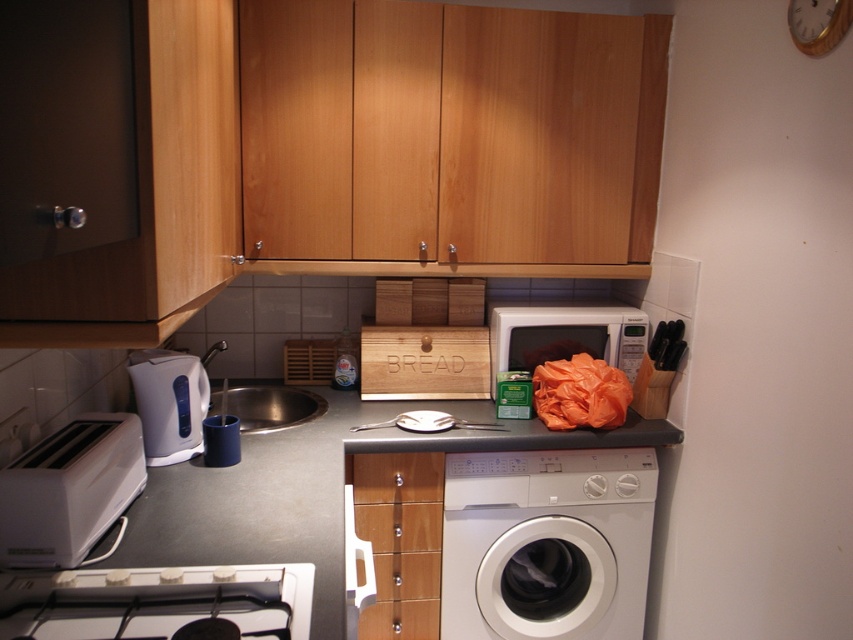
You are standing in the kitchen and want to place a recipe book on the counter near the white glossy stove at lower left so it can be seen from the wooden clock at upper right. Is the stove positioned in a way that the clock can see the book?

The white glossy stove at lower left is below the wooden clock at upper right, so the clock can see the book placed near the stove because it is positioned lower and directly under the clock.

You are standing in the kitchen and want to see the wooden clock at upper right. However, the white glossy stove at lower left is blocking your view. Can you move around the stove to get a clear view of the clock?

The white glossy stove at lower left is in front of the wooden clock at upper right, so moving around the stove would allow you to see the clock clearly.

You are moving a 70 cm wide box from the kitchen to the laundry room. You need to pass between the white glossy washing machine at lower right and the stainless steel sink at center. Can the box fit through the space between them?

The white glossy washing machine at lower right and the stainless steel sink at center are 73.46 centimeters apart from each other. Since the box is 70 centimeters wide, it can fit through the space between them as 73.46 cm is wider than 70 cm.